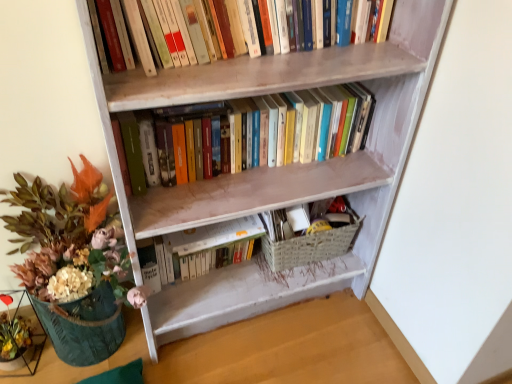
Question: Is wooden bookcase at center wider than woven beige basket at lower center?

Choices:
 (A) no
 (B) yes

Answer: (B)

Question: Is the surface of wooden bookcase at center in direct contact with woven beige basket at lower center?

Choices:
 (A) yes
 (B) no

Answer: (B)

Question: From a real-world perspective, is wooden bookcase at center on top of woven beige basket at lower center?

Choices:
 (A) no
 (B) yes

Answer: (B)

Question: Is wooden bookcase at center shorter than woven beige basket at lower center?

Choices:
 (A) no
 (B) yes

Answer: (A)

Question: Considering the relative sizes of wooden bookcase at center and woven beige basket at lower center in the image provided, is wooden bookcase at center taller than woven beige basket at lower center?

Choices:
 (A) no
 (B) yes

Answer: (B)

Question: Is wooden bookcase at center bigger or smaller than hardcover books at center, which is the 2th book in bottom-to-top order?

Choices:
 (A) big
 (B) small

Answer: (A)

Question: Considering the positions of wooden bookcase at center and hardcover books at center, which is the 2th book in bottom-to-top order, in the image, is wooden bookcase at center wider or thinner than hardcover books at center, which is the 2th book in bottom-to-top order,?

Choices:
 (A) wide
 (B) thin

Answer: (A)

Question: Relative to hardcover books at center, the second book when ordered from top to bottom, is wooden bookcase at center in front or behind?

Choices:
 (A) behind
 (B) front

Answer: (B)

Question: From a real-world perspective, is wooden bookcase at center physically located above or below hardcover books at center, which is the 2th book in bottom-to-top order?

Choices:
 (A) below
 (B) above

Answer: (A)

Question: Considering the positions of hardcover books at center, which is the 2th book in bottom-to-top order, and white matte book at center, which appears as the 1th book when ordered from the bottom, in the image, is hardcover books at center, which is the 2th book in bottom-to-top order, wider or thinner than white matte book at center, which appears as the 1th book when ordered from the bottom,?

Choices:
 (A) thin
 (B) wide

Answer: (B)

Question: Is hardcover books at center, the second book when ordered from top to bottom, bigger or smaller than white matte book at center, which appears as the 1th book when ordered from the bottom?

Choices:
 (A) small
 (B) big

Answer: (B)

Question: Is point (128, 155) closer or farther from the camera than point (185, 258)?

Choices:
 (A) farther
 (B) closer

Answer: (B)

Question: Is hardcover books at center, which is the 2th book in bottom-to-top order, taller or shorter than white matte book at center, which appears as the 1th book when ordered from the bottom?

Choices:
 (A) tall
 (B) short

Answer: (A)

Question: From the image's perspective, is wooden bookcase at center above or below green textured vase at lower left?

Choices:
 (A) below
 (B) above

Answer: (B)

Question: From their relative heights in the image, would you say wooden bookcase at center is taller or shorter than green textured vase at lower left?

Choices:
 (A) tall
 (B) short

Answer: (A)